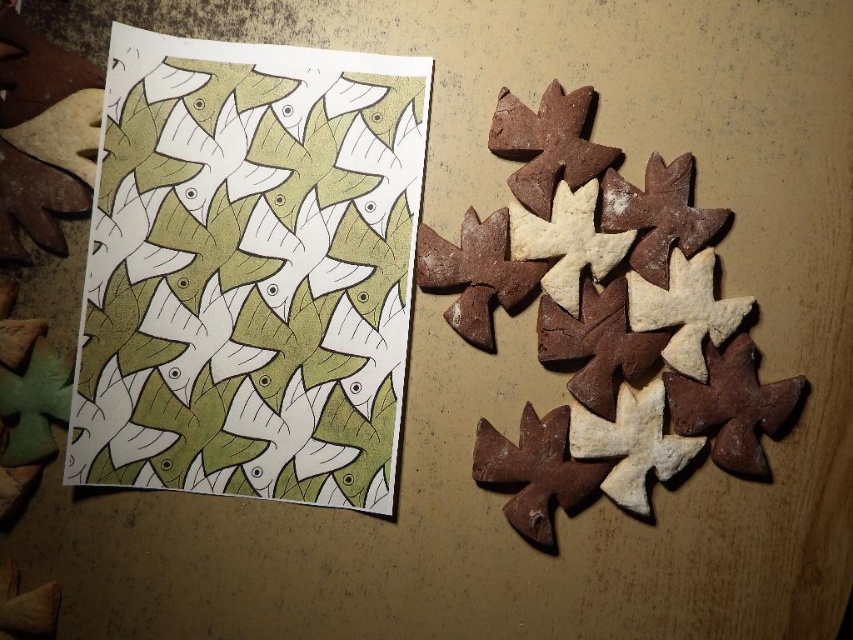
Can you confirm if green paper at upper left is positioned below brown crumbly gingerbread at right?

Incorrect, green paper at upper left is not positioned below brown crumbly gingerbread at right.

Is green paper at upper left wider than brown crumbly gingerbread at right?

In fact, green paper at upper left might be narrower than brown crumbly gingerbread at right.

Which is in front, point (198, 200) or point (642, 380)?

Point (198, 200)

Find the location of `green paper at upper left`. green paper at upper left is located at coordinates (248, 280).